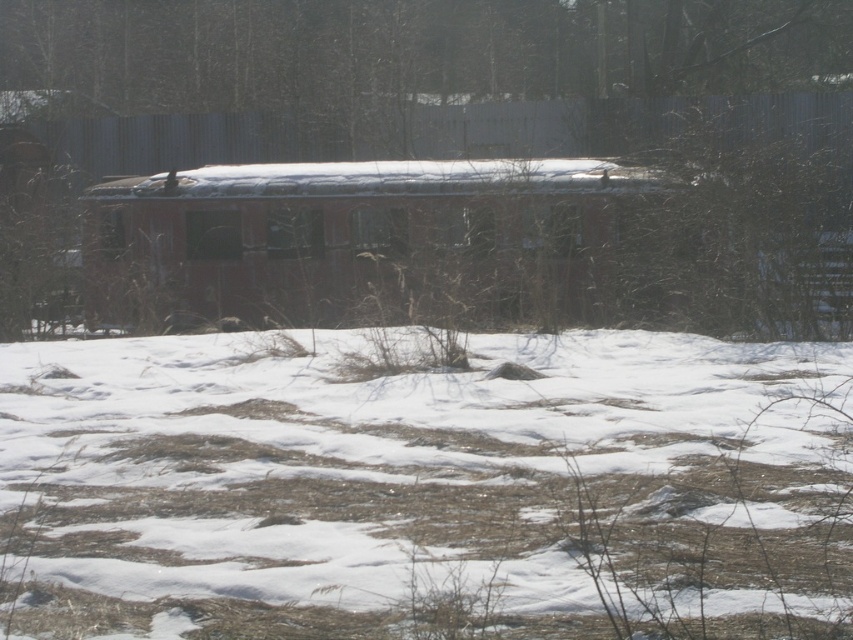
Who is higher up, rusty metal train car at center or brown textured fence at upper center?

brown textured fence at upper center is higher up.

From the picture: Between rusty metal train car at center and brown textured fence at upper center, which one has more height?

brown textured fence at upper center is taller.

This screenshot has height=640, width=853. Describe the element at coordinates (387, 243) in the screenshot. I see `rusty metal train car at center` at that location.

At what (x,y) coordinates should I click in order to perform the action: click on rusty metal train car at center. Please return your answer as a coordinate pair (x, y). Looking at the image, I should click on (387, 243).

Is white fluffy snow at lower center positioned in front of brown textured fence at upper center?

Yes.

Is white fluffy snow at lower center to the left of brown textured fence at upper center from the viewer's perspective?

No, white fluffy snow at lower center is not to the left of brown textured fence at upper center.

Measure the distance between white fluffy snow at lower center and camera.

A distance of 5.44 meters exists between white fluffy snow at lower center and camera.

Find the location of a particular element. white fluffy snow at lower center is located at coordinates (424, 490).

From the picture: Can you confirm if white fluffy snow at lower center is positioned to the left of rusty metal train car at center?

Indeed, white fluffy snow at lower center is positioned on the left side of rusty metal train car at center.

Who is more distant from viewer, [508,412] or [683,195]?

Point [683,195]

Where is `white fluffy snow at lower center`? This screenshot has width=853, height=640. white fluffy snow at lower center is located at coordinates (424, 490).